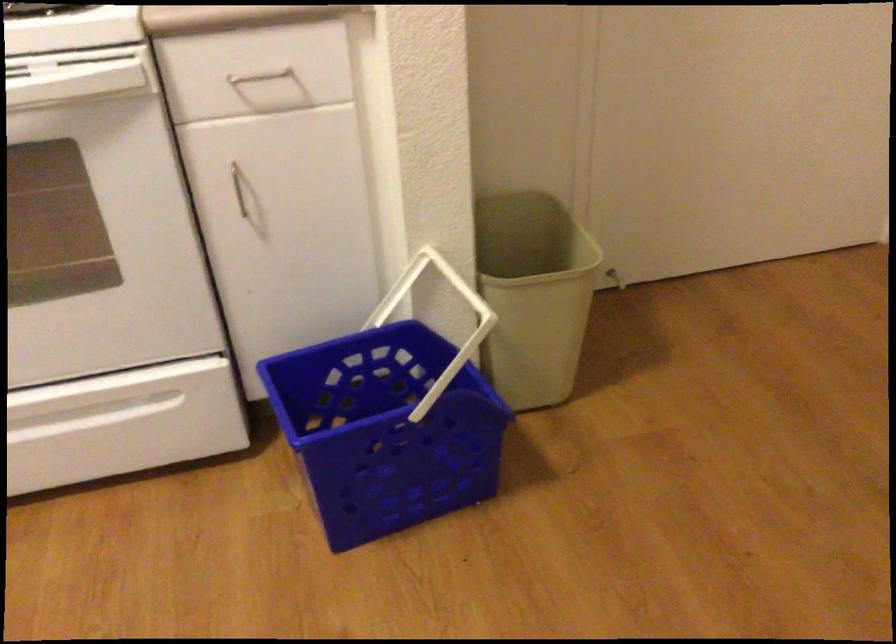
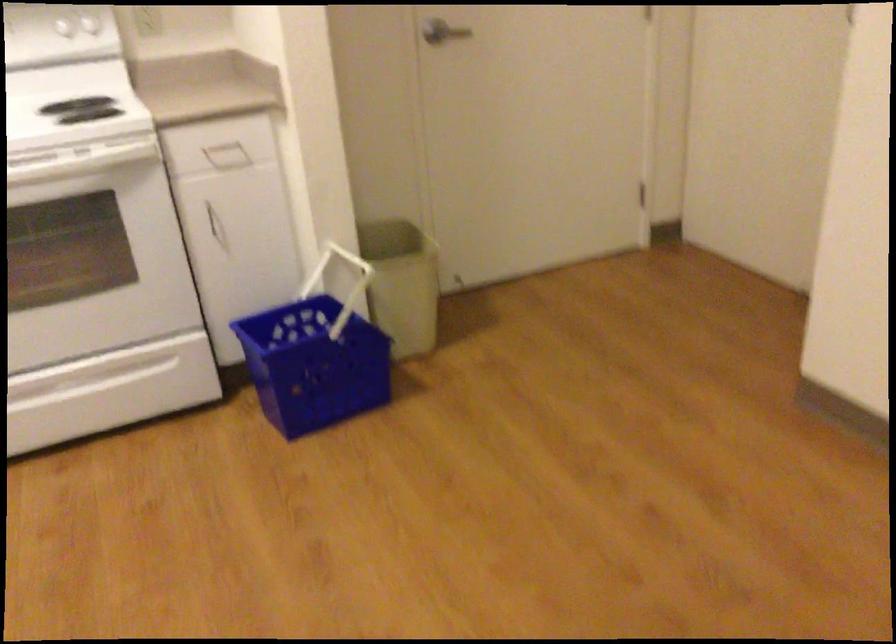
The point at (274, 98) is marked in the first image. Where is the corresponding point in the second image?

(227, 156)